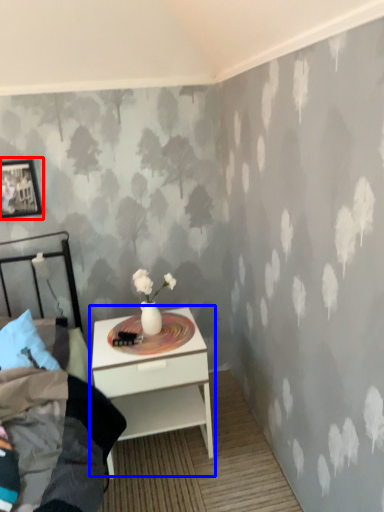
Question: Among these objects, which one is farthest to the camera, picture frame (highlighted by a red box) or nightstand (highlighted by a blue box)?

Choices:
 (A) picture frame
 (B) nightstand

Answer: (A)